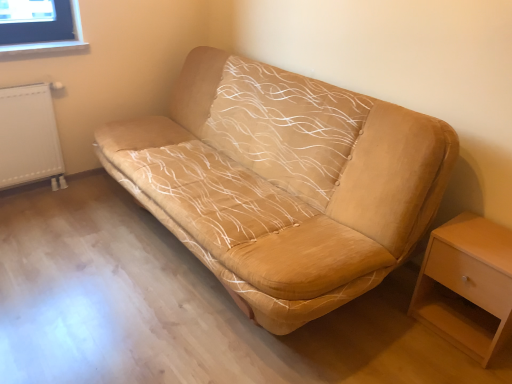
You are a GUI agent. You are given a task and a screenshot of the screen. Output one action in this format:
    pyautogui.click(x=<x>, y=<y>)
    Task: Click on the free space underneath white textured radiator at left (from a real-world perspective)
    The width and height of the screenshot is (512, 384).
    Given the screenshot: What is the action you would take?
    pyautogui.click(x=40, y=190)